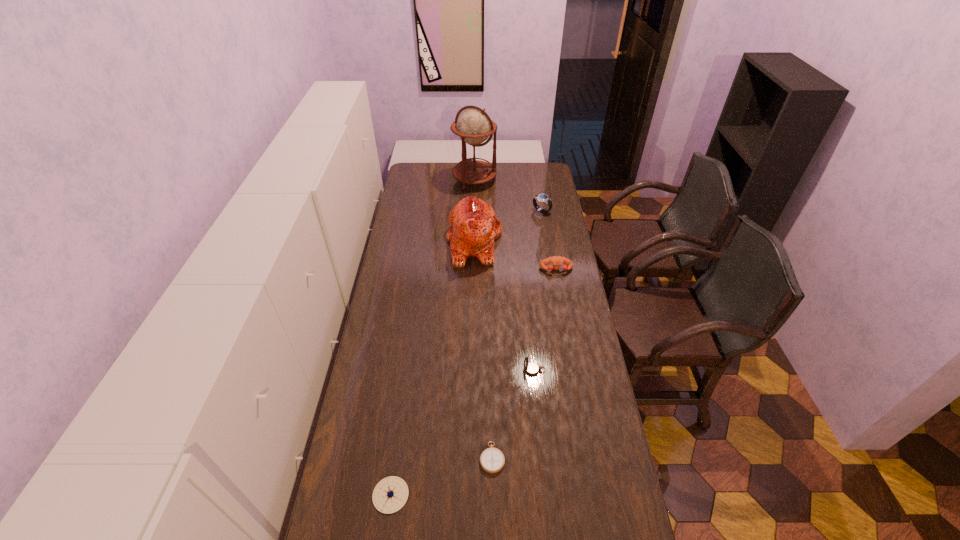
Locate an element on the screen. globe is located at coordinates (474, 126).

Find the location of a particular element. The width and height of the screenshot is (960, 540). the farthest object is located at coordinates (474, 126).

Identify the location of cat. (474, 226).

This screenshot has height=540, width=960. Identify the location of the sixth nearest object. (543, 198).

Image resolution: width=960 pixels, height=540 pixels. I want to click on the fourth shortest object, so click(x=531, y=368).

Locate an element on the screen. The height and width of the screenshot is (540, 960). the tallest compass is located at coordinates [531, 368].

Find the location of a particular element. puncher is located at coordinates (557, 261).

Identify the location of the second shortest compass. The width and height of the screenshot is (960, 540). (391, 493).

At what (x,y) coordinates should I click in order to perform the action: click on the leftmost object. Please return your answer as a coordinate pair (x, y). Looking at the image, I should click on (391, 493).

Where is `the sixth farthest object`? This screenshot has width=960, height=540. the sixth farthest object is located at coordinates (492, 460).